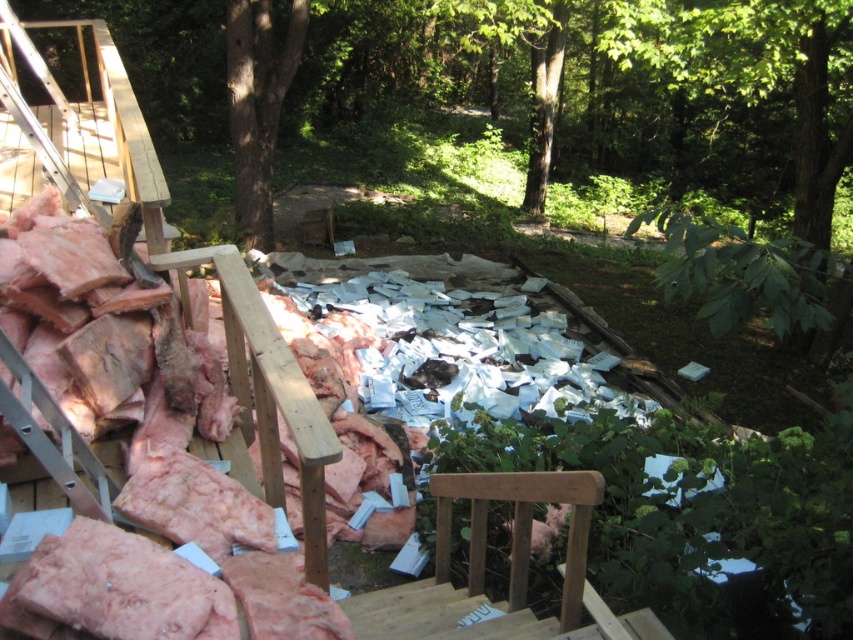
Question: Can you confirm if green leafy tree at center is positioned to the right of wooden ladder at upper left?

Choices:
 (A) yes
 (B) no

Answer: (B)

Question: Is green leafy tree at center below wooden ladder at upper left?

Choices:
 (A) yes
 (B) no

Answer: (B)

Question: Which of the following is the closest to the observer?

Choices:
 (A) (56, 180)
 (B) (267, 205)

Answer: (A)

Question: Is green leafy tree at center in front of wooden ladder at upper left?

Choices:
 (A) yes
 (B) no

Answer: (B)

Question: Which point is farther to the camera?

Choices:
 (A) green leafy tree at center
 (B) wooden ladder at upper left

Answer: (A)